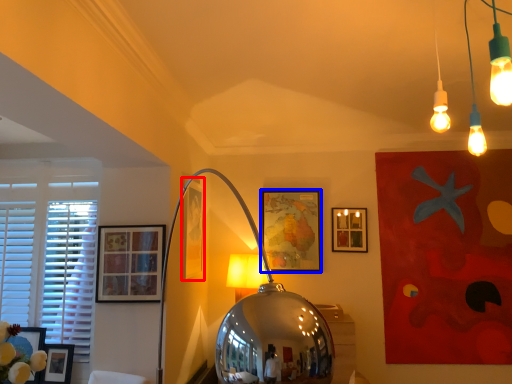
Question: Which point is further to the camera, picture frame (highlighted by a red box) or picture frame (highlighted by a blue box)?

Choices:
 (A) picture frame
 (B) picture frame

Answer: (B)